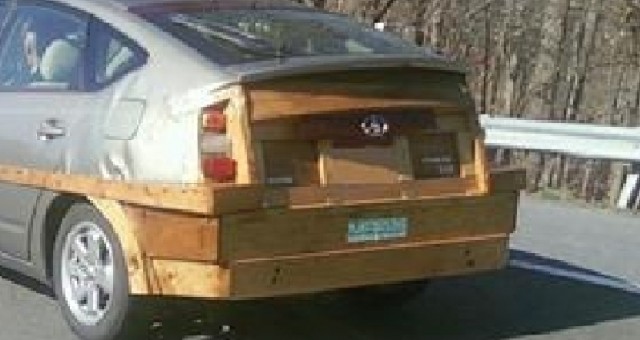
The image size is (640, 340). Find the location of `door`. door is located at coordinates (33, 118).